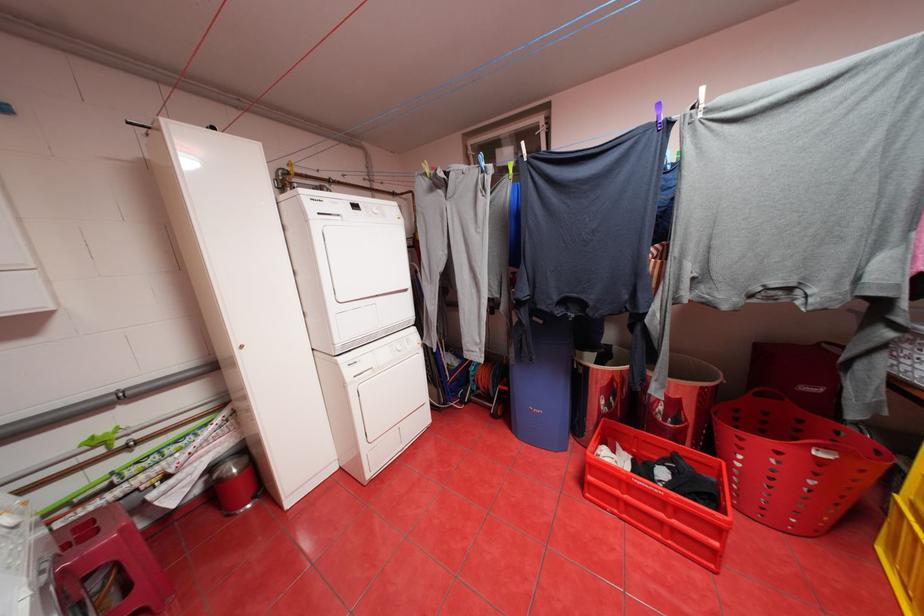
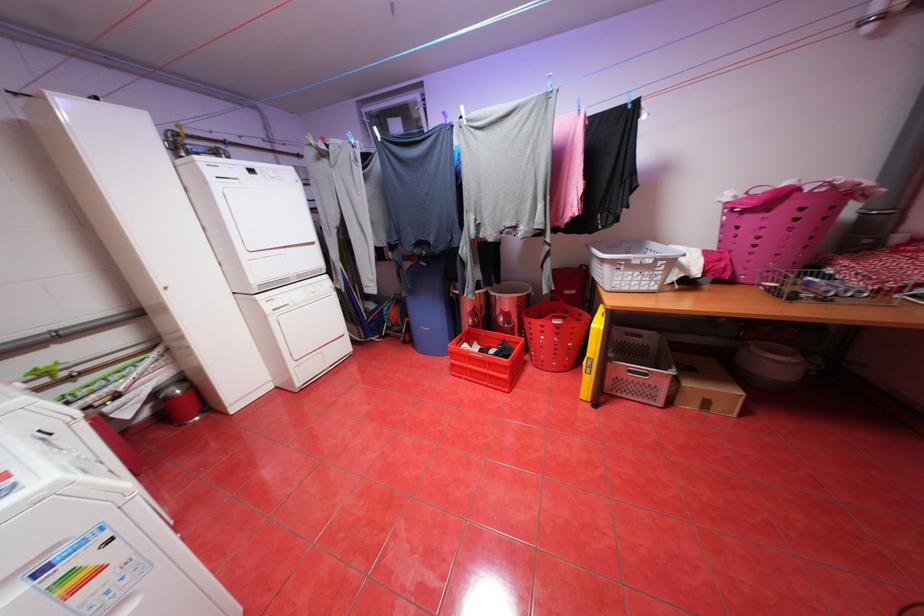
In the second image, find the point that corresponds to (631,448) in the first image.

(488, 344)